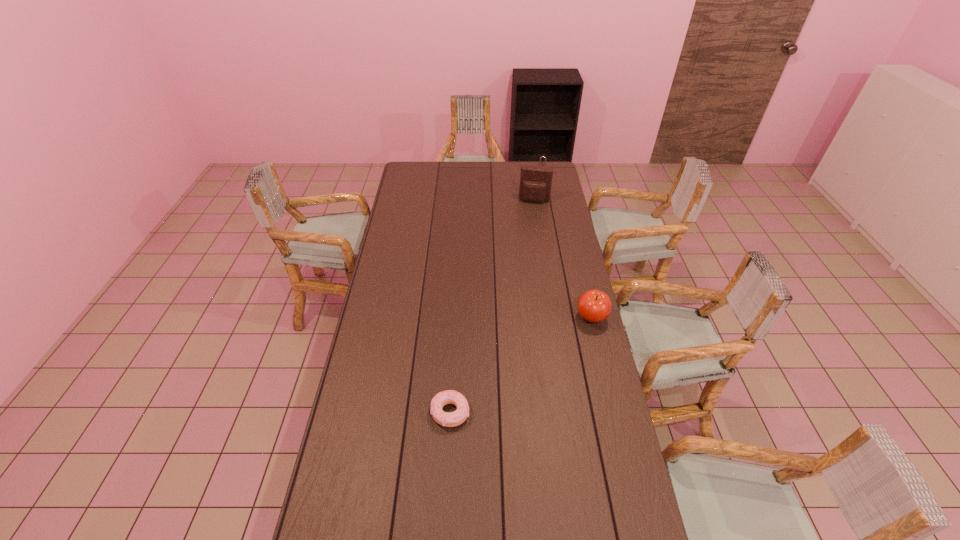
The image size is (960, 540). In order to click on empty space that is in between the padlock and the doughnut in this screenshot , I will do `click(495, 295)`.

Locate an element on the screen. empty location between the rightmost object and the pouch is located at coordinates [x=563, y=259].

In order to click on free spot between the farthest object and the shortest object in this screenshot , I will do `click(495, 295)`.

The height and width of the screenshot is (540, 960). Find the location of `vacant area that lies between the tallest object and the second nearest object`. vacant area that lies between the tallest object and the second nearest object is located at coordinates (563, 259).

Where is `object identified as the closest to the shortest object`? The image size is (960, 540). object identified as the closest to the shortest object is located at coordinates click(594, 306).

Locate which object ranks third in proximity to the shortest object. Please provide its 2D coordinates. Your answer should be formatted as a tuple, i.e. [(x, y)], where the tuple contains the x and y coordinates of a point satisfying the conditions above.

[(542, 156)]

You are a GUI agent. You are given a task and a screenshot of the screen. Output one action in this format:
    pyautogui.click(x=<x>, y=<y>)
    Task: Click on the free space that satisfies the following two spatial constraints: 1. on the back side of the third nearest object; 2. on the right side of the doughnut
    
    Given the screenshot: What is the action you would take?
    pyautogui.click(x=462, y=201)